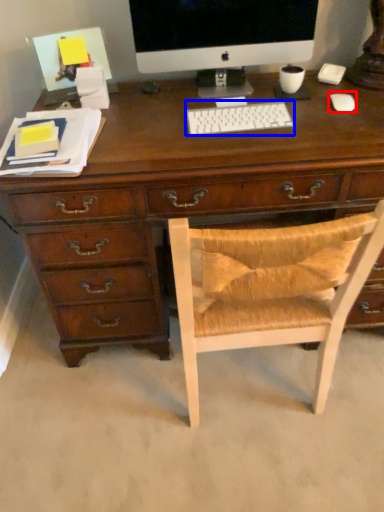
Question: Which point is further to the camera, mouse (highlighted by a red box) or computer keyboard (highlighted by a blue box)?

Choices:
 (A) mouse
 (B) computer keyboard

Answer: (A)